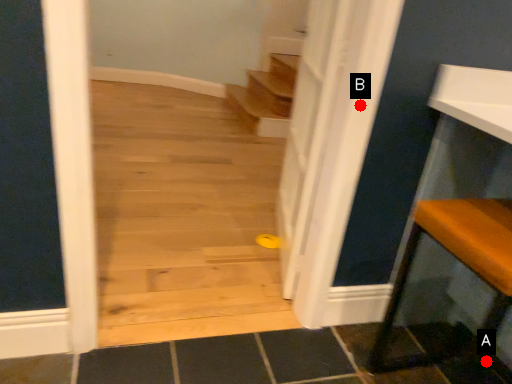
Question: Two points are circled on the image, labeled by A and B beside each circle. Among these points, which one is farthest from the camera?

Choices:
 (A) A is further
 (B) B is further

Answer: (A)